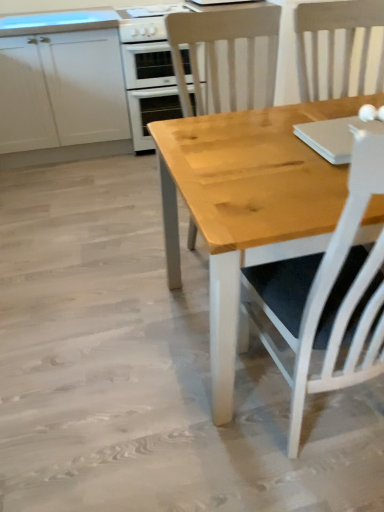
Question: Does white glossy gas stove at upper center turn towards wooden chair at center?

Choices:
 (A) yes
 (B) no

Answer: (A)

Question: Can you confirm if white glossy gas stove at upper center is positioned to the right of wooden chair at center?

Choices:
 (A) yes
 (B) no

Answer: (B)

Question: From a real-world perspective, is white glossy gas stove at upper center under wooden chair at center?

Choices:
 (A) no
 (B) yes

Answer: (A)

Question: Can you confirm if white glossy gas stove at upper center is thinner than wooden chair at center?

Choices:
 (A) yes
 (B) no

Answer: (B)

Question: Is white glossy gas stove at upper center oriented away from wooden chair at center?

Choices:
 (A) no
 (B) yes

Answer: (A)

Question: From the image's perspective, is white glossy gas stove at upper center under wooden chair at center?

Choices:
 (A) yes
 (B) no

Answer: (B)

Question: Can you confirm if white matte cabinet at upper left is taller than white glossy gas stove at upper center?

Choices:
 (A) yes
 (B) no

Answer: (A)

Question: Does white matte cabinet at upper left come behind white glossy gas stove at upper center?

Choices:
 (A) yes
 (B) no

Answer: (B)

Question: Are white matte cabinet at upper left and white glossy gas stove at upper center beside each other?

Choices:
 (A) yes
 (B) no

Answer: (B)

Question: Is white matte cabinet at upper left to the left of white glossy gas stove at upper center from the viewer's perspective?

Choices:
 (A) no
 (B) yes

Answer: (B)

Question: Could you tell me if white matte cabinet at upper left is turned towards white glossy gas stove at upper center?

Choices:
 (A) yes
 (B) no

Answer: (B)

Question: From the image's perspective, is white matte cabinet at upper left located above white glossy gas stove at upper center?

Choices:
 (A) no
 (B) yes

Answer: (A)

Question: Does white matte cabinet at upper left appear on the right side of wooden chair at center?

Choices:
 (A) yes
 (B) no

Answer: (B)